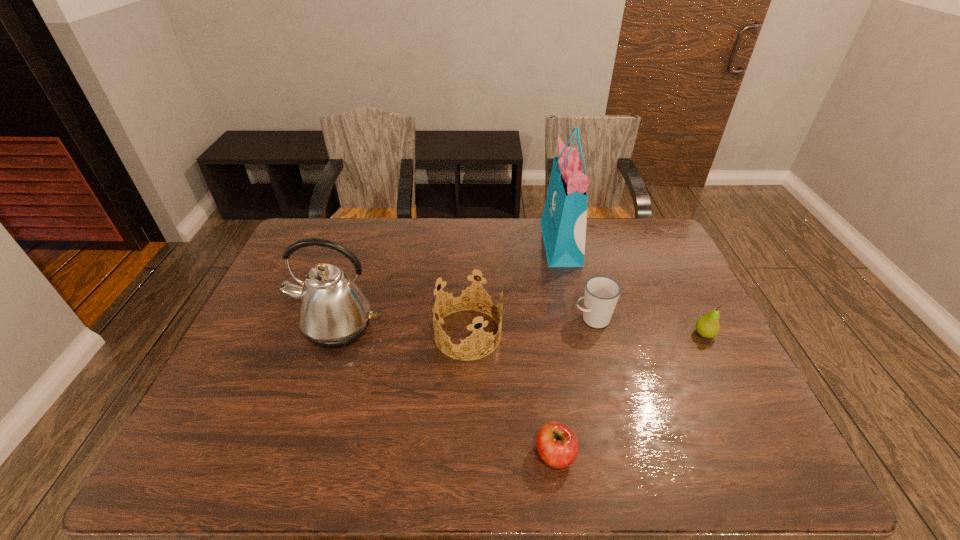
Identify the location of free point located on the right of the tallest object. (629, 243).

The image size is (960, 540). Identify the location of vacant space situated from the spout of the second tallest object. (304, 426).

I want to click on free space located 0.220m on the front of the fourth shortest object, so click(x=465, y=440).

Locate an element on the screen. The height and width of the screenshot is (540, 960). vacant space positioned 0.320m with a handle on the side of the cup is located at coordinates (462, 319).

Find the location of a particular element. blank area located with a handle on the side of the cup is located at coordinates (549, 319).

What are the coordinates of `free region located with a handle on the side of the cup` in the screenshot? It's located at (503, 319).

You are a GUI agent. You are given a task and a screenshot of the screen. Output one action in this format:
    pyautogui.click(x=<x>, y=<y>)
    Task: Click on the vacant area located on the left of the pear
    This screenshot has width=960, height=540.
    Given the screenshot: What is the action you would take?
    pyautogui.click(x=668, y=334)

Locate an element on the screen. Image resolution: width=960 pixels, height=540 pixels. free space located on the back of the third object from left to right is located at coordinates (549, 415).

Find the location of `object present at the far edge`. object present at the far edge is located at coordinates pyautogui.click(x=563, y=223).

Image resolution: width=960 pixels, height=540 pixels. I want to click on object that is at the near edge, so click(557, 444).